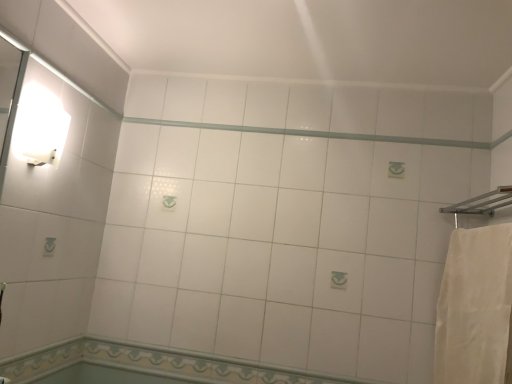
Question: Which direction should I rotate to face decorative tile border at lower center, which is the 2th bath in top-to-bottom order, — up or down?

Choices:
 (A) down
 (B) up

Answer: (A)

Question: Considering the relative sizes of white glossy tile at lower center, the 2th bath ordered from the bottom, and white cotton bath towel at right in the image provided, is white glossy tile at lower center, the 2th bath ordered from the bottom, thinner than white cotton bath towel at right?

Choices:
 (A) no
 (B) yes

Answer: (B)

Question: Considering the relative sizes of white glossy tile at lower center, the 2th bath ordered from the bottom, and white cotton bath towel at right in the image provided, is white glossy tile at lower center, the 2th bath ordered from the bottom, taller than white cotton bath towel at right?

Choices:
 (A) no
 (B) yes

Answer: (A)

Question: From the image's perspective, is white glossy tile at lower center, arranged as the 1th bath when viewed from the top, below white cotton bath towel at right?

Choices:
 (A) yes
 (B) no

Answer: (A)

Question: Is white glossy tile at lower center, arranged as the 1th bath when viewed from the top, next to white cotton bath towel at right?

Choices:
 (A) no
 (B) yes

Answer: (A)

Question: Is white glossy tile at lower center, arranged as the 1th bath when viewed from the top, completely or partially outside of white cotton bath towel at right?

Choices:
 (A) no
 (B) yes

Answer: (B)

Question: From a real-world perspective, does white glossy tile at lower center, the 2th bath ordered from the bottom, stand above white cotton bath towel at right?

Choices:
 (A) no
 (B) yes

Answer: (A)

Question: Can you see white glossy beam at center touching white glossy wall sconce at upper left?

Choices:
 (A) no
 (B) yes

Answer: (A)

Question: Is white glossy beam at center far away from white glossy wall sconce at upper left?

Choices:
 (A) yes
 (B) no

Answer: (B)

Question: Does white glossy beam at center have a greater height compared to white glossy wall sconce at upper left?

Choices:
 (A) yes
 (B) no

Answer: (B)

Question: Considering the relative sizes of white glossy beam at center and white glossy wall sconce at upper left in the image provided, is white glossy beam at center shorter than white glossy wall sconce at upper left?

Choices:
 (A) yes
 (B) no

Answer: (A)

Question: Is white glossy beam at center to the right of white glossy wall sconce at upper left from the viewer's perspective?

Choices:
 (A) no
 (B) yes

Answer: (B)

Question: Considering the relative sizes of white glossy beam at center and white glossy wall sconce at upper left in the image provided, is white glossy beam at center smaller than white glossy wall sconce at upper left?

Choices:
 (A) no
 (B) yes

Answer: (B)

Question: Can you confirm if white glossy beam at center is taller than decorative tile border at lower center, which is the 2th bath in top-to-bottom order?

Choices:
 (A) yes
 (B) no

Answer: (B)